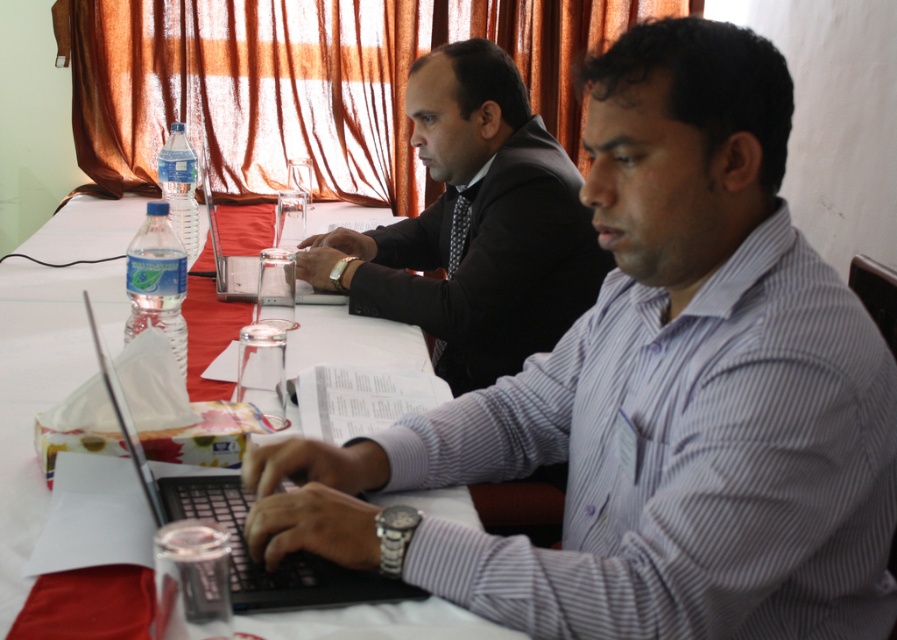
Question: Where is matte black suit at center located in relation to black plastic laptop at center in the image?

Choices:
 (A) above
 (B) below

Answer: (A)

Question: Does matte black suit at center appear under clear plastic laptop at center?

Choices:
 (A) yes
 (B) no

Answer: (A)

Question: Can you confirm if white paper at center is bigger than black plastic laptop at center?

Choices:
 (A) no
 (B) yes

Answer: (B)

Question: Which object is closer to the camera taking this photo?

Choices:
 (A) matte black laptop at center
 (B) clear plastic laptop at center
 (C) white paper at center
 (D) black plastic laptop at center

Answer: (A)

Question: Which object is farther from the camera taking this photo?

Choices:
 (A) matte black suit at center
 (B) clear plastic laptop at center
 (C) matte black laptop at center

Answer: (B)

Question: Which of these objects is positioned farthest from the black plastic laptop at center?

Choices:
 (A) clear plastic laptop at center
 (B) matte black laptop at center
 (C) matte black suit at center
 (D) white paper at center

Answer: (A)